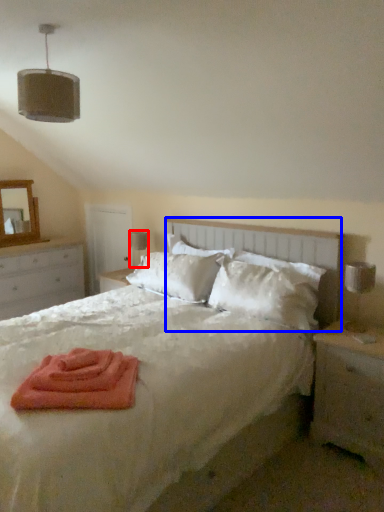
Question: Among these objects, which one is nearest to the camera, table lamp (highlighted by a red box) or headboard (highlighted by a blue box)?

Choices:
 (A) table lamp
 (B) headboard

Answer: (B)